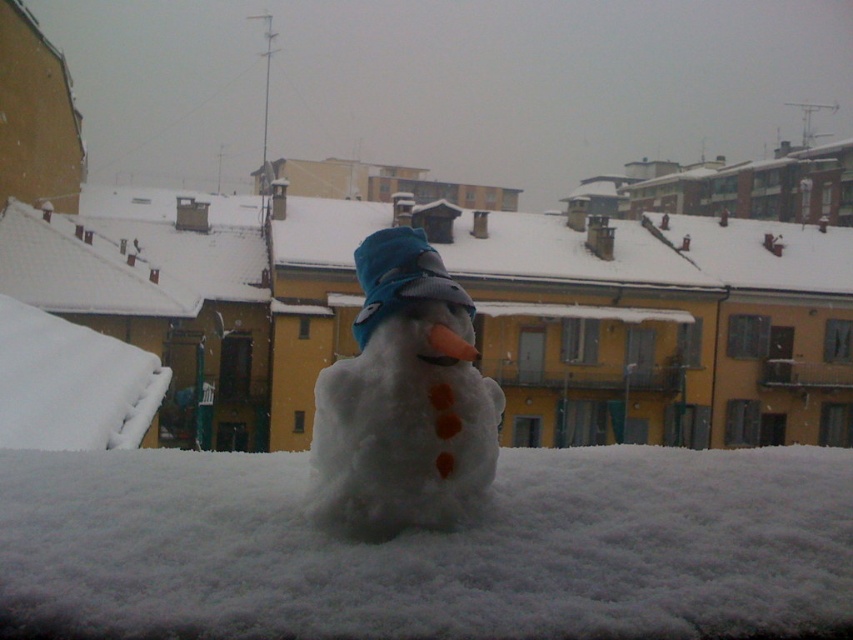
Question: Does white fluffy snow at center appear over white fluffy snowman at center?

Choices:
 (A) no
 (B) yes

Answer: (A)

Question: Which point is farther from the camera taking this photo?

Choices:
 (A) (370, 436)
 (B) (640, 637)

Answer: (A)

Question: Which object is closer to the camera taking this photo?

Choices:
 (A) white fluffy snowman at center
 (B) white fluffy snow at center

Answer: (B)

Question: Where is white fluffy snow at center located in relation to white fluffy snowman at center in the image?

Choices:
 (A) right
 (B) left

Answer: (A)

Question: Does white fluffy snow at center come in front of white fluffy snowman at center?

Choices:
 (A) no
 (B) yes

Answer: (B)